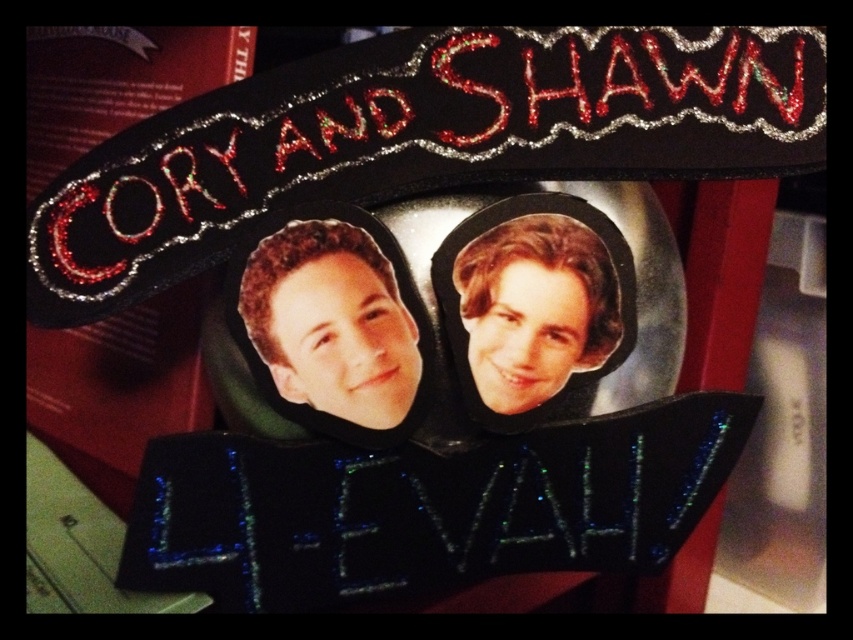
You are holding a matte plastic head at center that is 39.31 inches away from you. If you want to place it on a shelf that is 40 inches tall, will it fit vertically?

The matte plastic head at center is 39.31 inches away from the viewer, but the distance does not indicate its height. The question about fitting on a 40 inch tall shelf cannot be answered with the given information.

You have a small decorative item with a heart shape. It has a matte plastic head at center and shiny brown hair at upper center. If you want to place this item on a shelf that can only hold items up to 6 inches in width, will it fit?

The distance between the matte plastic head at center and the shiny brown hair at upper center is 5.98 inches, so the item will fit on the shelf since it is just under the 6 inch limit.

You are a customer at a craft store holding a matte plastic head at center and a shiny brown hair at upper center. You want to attach them to create a decoration. Which object should you place on top to ensure stability?

The shiny brown hair at upper center should be placed on top of the matte plastic head at center because the matte plastic head at center is positioned under the shiny brown hair at upper center, making it the base for stability.